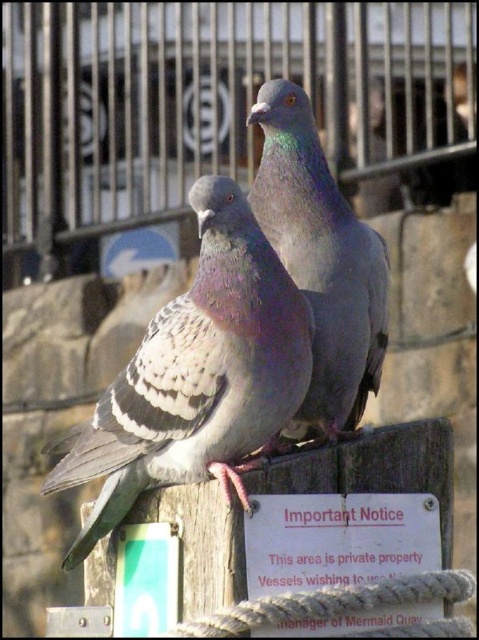
This screenshot has width=479, height=640. What do you see at coordinates (320, 260) in the screenshot?
I see `gray matte pigeon at center` at bounding box center [320, 260].

Is gray matte pigeon at center to the left of gray feathered pigeon at center from the viewer's perspective?

Correct, you'll find gray matte pigeon at center to the left of gray feathered pigeon at center.

This screenshot has width=479, height=640. I want to click on gray matte pigeon at center, so click(x=320, y=260).

Which of these two, brushed metal fence at upper center or gray matte pigeon at center, stands taller?

With more height is brushed metal fence at upper center.

Is brushed metal fence at upper center bigger than gray matte pigeon at center?

Yes, brushed metal fence at upper center is bigger than gray matte pigeon at center.

Identify the location of brushed metal fence at upper center. (207, 100).

Find the location of a particular element. This screenshot has width=479, height=640. brushed metal fence at upper center is located at coordinates pyautogui.click(x=207, y=100).

Is brushed metal fence at upper center to the right of gray feathered pigeon at center from the viewer's perspective?

No, brushed metal fence at upper center is not to the right of gray feathered pigeon at center.

Which of these two, brushed metal fence at upper center or gray feathered pigeon at center, stands shorter?

With less height is gray feathered pigeon at center.

Locate an element on the screen. The width and height of the screenshot is (479, 640). brushed metal fence at upper center is located at coordinates (207, 100).